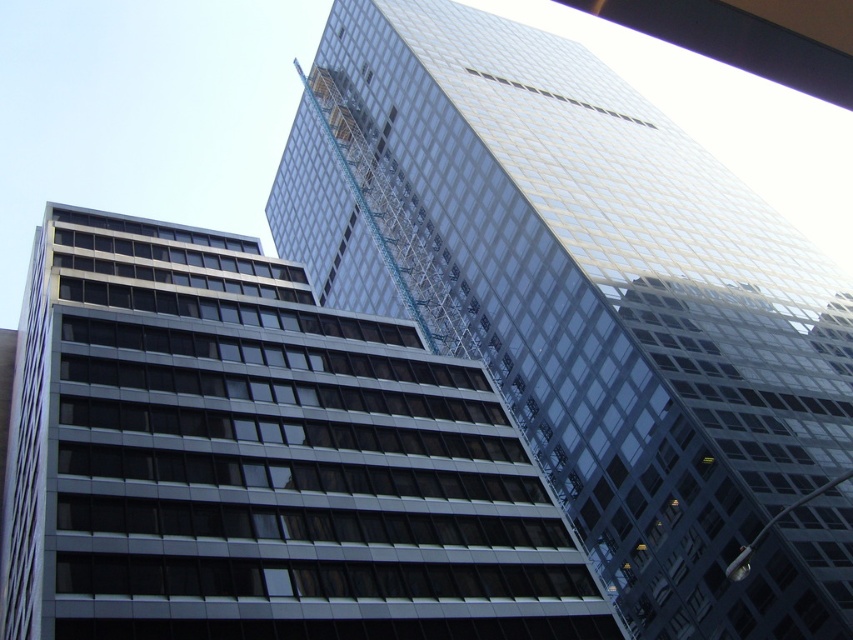
Looking at this image, you are an architect reviewing the city layout. You notice the transparent glass tower at upper center and the clear glass building at center. Which one is positioned higher in the image?

The transparent glass tower at upper center is positioned higher in the image than the clear glass building at center.

You are an architect reviewing the urban layout. From your vantage point, which building would appear closer to you when looking at the transparent glass tower at upper center and the clear glass building at center?

The clear glass building at center is behind the transparent glass tower at upper center, so the transparent glass tower at upper center would appear closer to you.